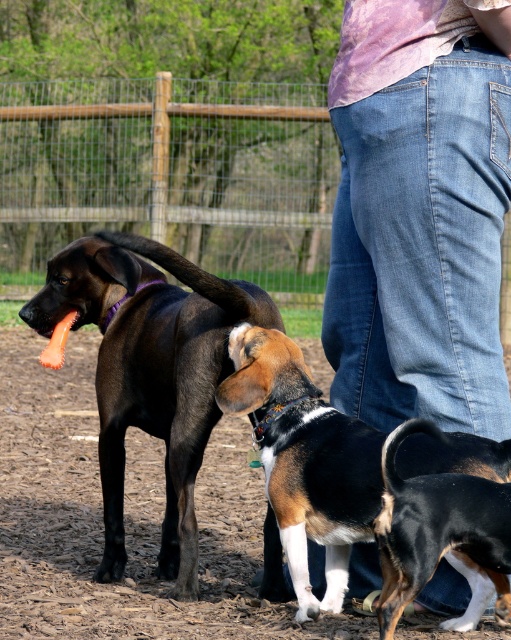
Who is taller, denim jeans at lower right or tri-color fur beagle at lower center?

denim jeans at lower right

The width and height of the screenshot is (511, 640). What do you see at coordinates (420, 212) in the screenshot?
I see `denim jeans at lower right` at bounding box center [420, 212].

Where is `denim jeans at lower right`? This screenshot has width=511, height=640. denim jeans at lower right is located at coordinates (420, 212).

Locate an element on the screen. denim jeans at lower right is located at coordinates (420, 212).

Is shiny black dog at center positioned at the back of brown and white fur at lower right?

Yes, shiny black dog at center is further from the viewer.

Can you confirm if shiny black dog at center is positioned below brown and white fur at lower right?

No, shiny black dog at center is not below brown and white fur at lower right.

This screenshot has width=511, height=640. I want to click on shiny black dog at center, so click(150, 371).

Does wooden fence at upper center appear over brown and white fur at lower right?

Indeed, wooden fence at upper center is positioned over brown and white fur at lower right.

Who is more forward, (11,211) or (403,433)?

Point (403,433)

Identify the location of wooden fence at upper center. (173, 172).